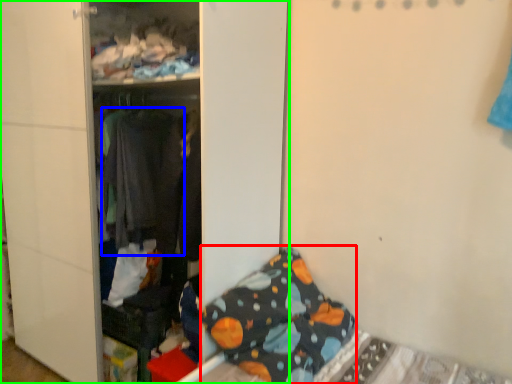
Question: Which object is positioned farthest from pillow (highlighted by a red box)? Select from clothing (highlighted by a blue box) and furniture (highlighted by a green box).

Choices:
 (A) clothing
 (B) furniture

Answer: (A)